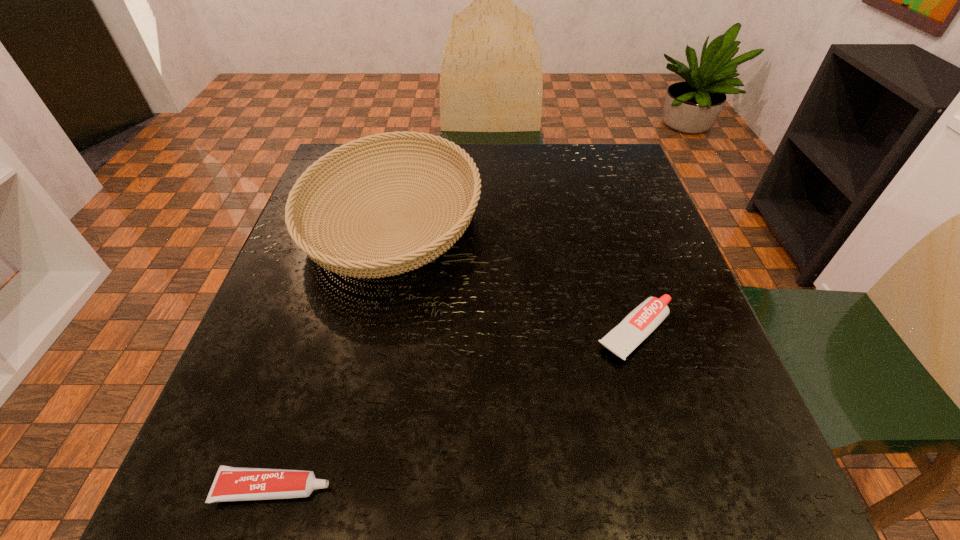
You are a GUI agent. You are given a task and a screenshot of the screen. Output one action in this format:
    pyautogui.click(x=<x>, y=<y>)
    Task: Click on the closest object to the tallest object
    Image resolution: width=960 pixels, height=540 pixels.
    Given the screenshot: What is the action you would take?
    pyautogui.click(x=644, y=319)

Locate an element on the screen. The image size is (960, 540). object that is the second closest to the basket is located at coordinates (231, 483).

Locate an element on the screen. vacant space that satisfies the following two spatial constraints: 1. on the front side of the farther toothpaste; 2. at the nozzle of the left toothpaste is located at coordinates (683, 488).